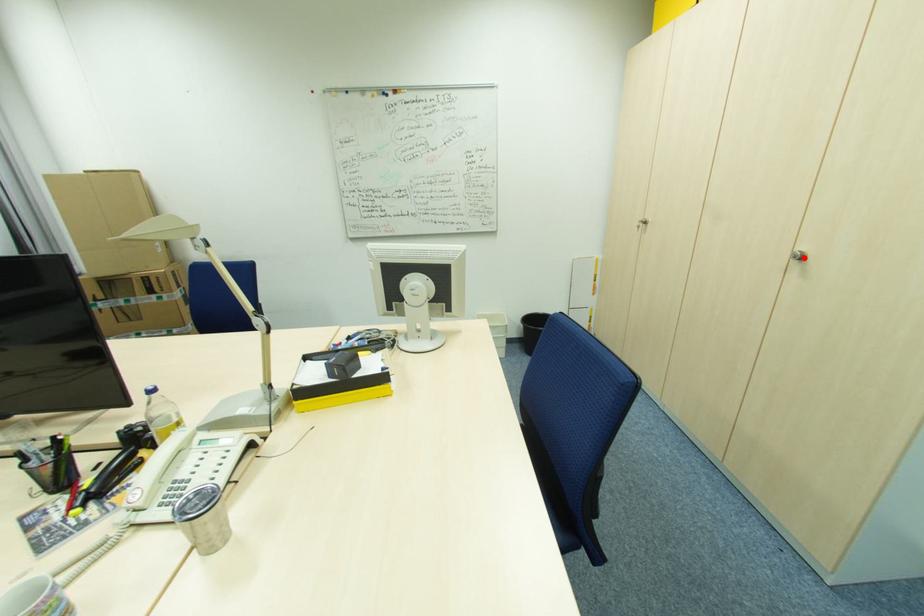
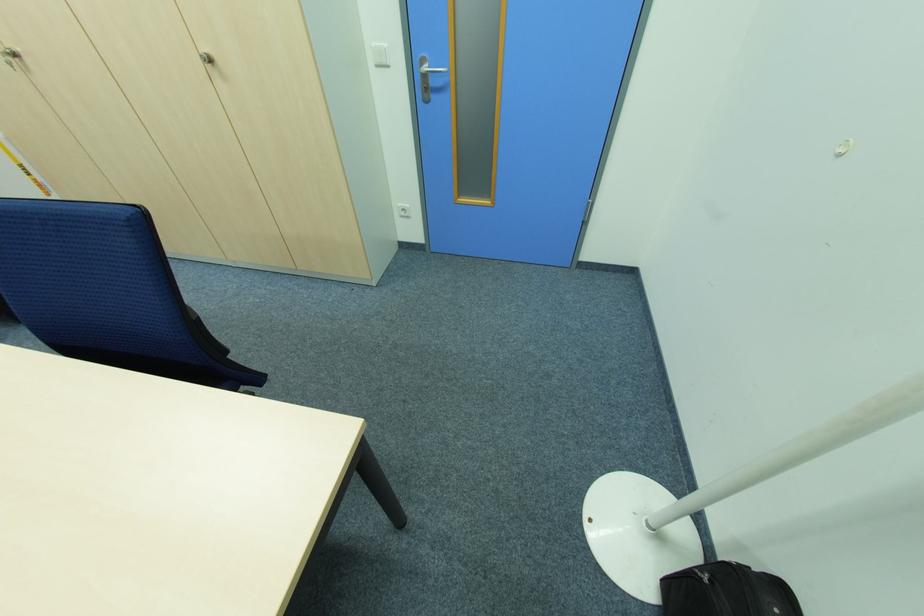
Locate, in the second image, the point that corresponds to the highlighted location in the first image.

(213, 62)